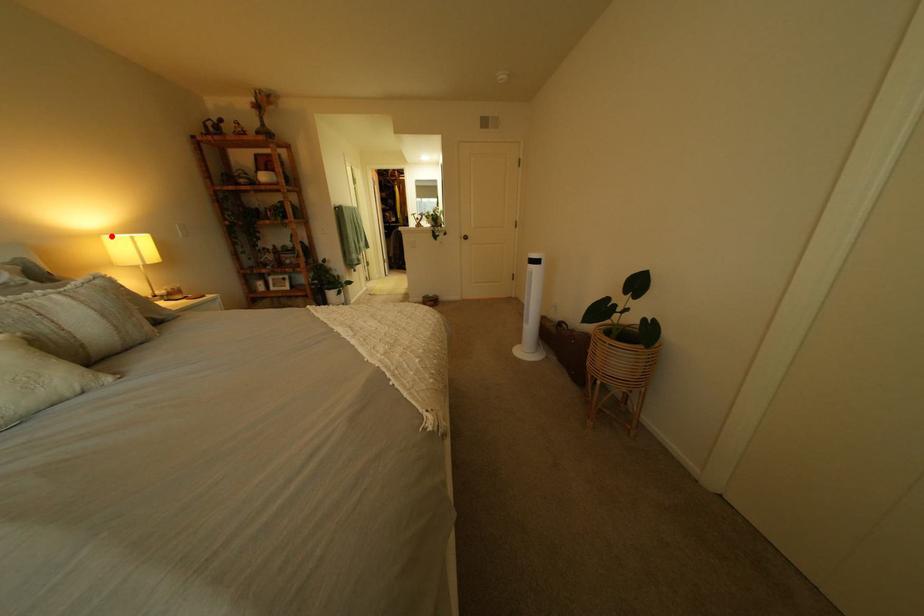
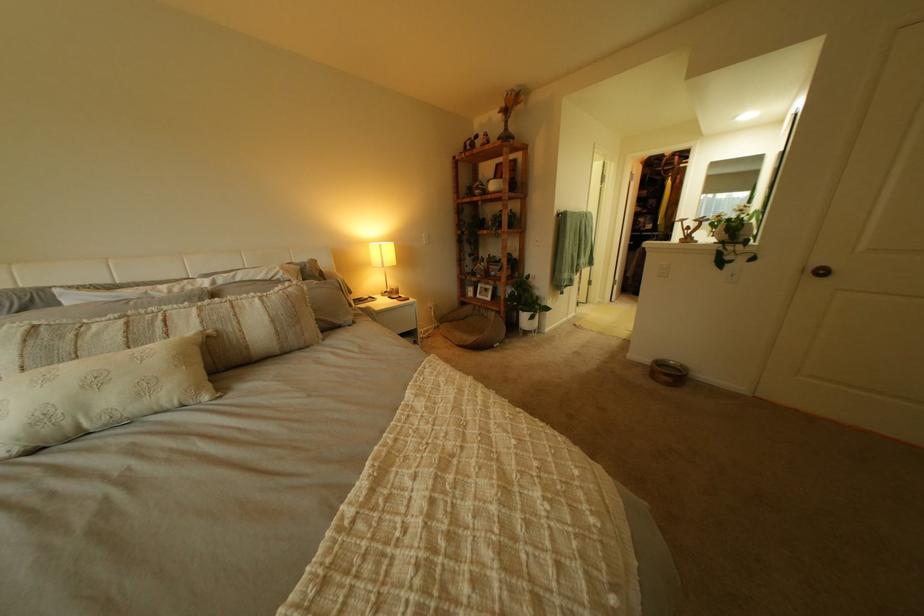
Question: A red point is marked in image1. In image2, is the corresponding 3D point closer to the camera or farther? Reply with the corresponding letter.

Choices:
 (A) The corresponding 3D point is closer.
 (B) The corresponding 3D point is farther.

Answer: (A)